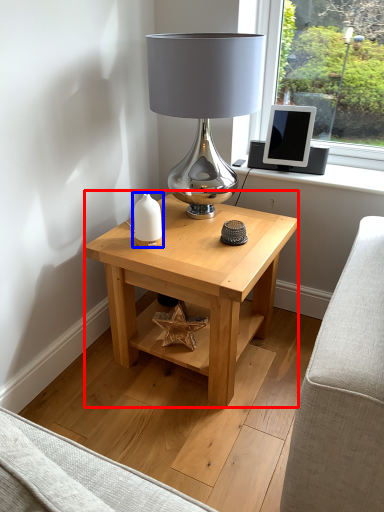
Question: Which of the following is the farthest to the observer, table (highlighted by a red box) or candle holder (highlighted by a blue box)?

Choices:
 (A) table
 (B) candle holder

Answer: (B)